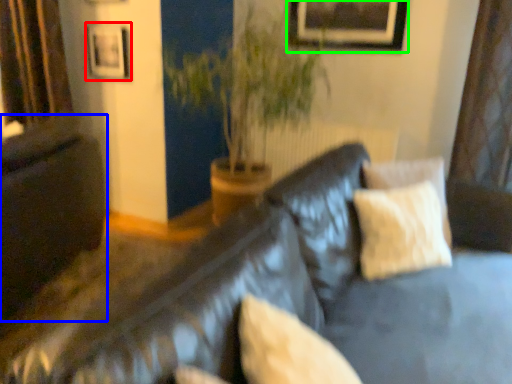
Question: Based on their relative distances, which object is farther from picture frame (highlighted by a red box)? Choose from dark (highlighted by a blue box) and picture frame (highlighted by a green box).

Choices:
 (A) dark
 (B) picture frame

Answer: (B)